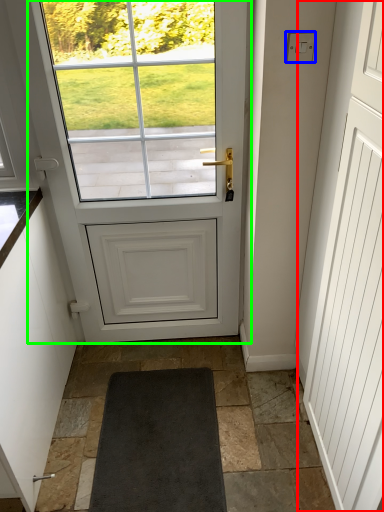
Question: Which object is positioned farthest from screen door (highlighted by a red box)? Select from lock (highlighted by a blue box) and door (highlighted by a green box).

Choices:
 (A) lock
 (B) door

Answer: (A)